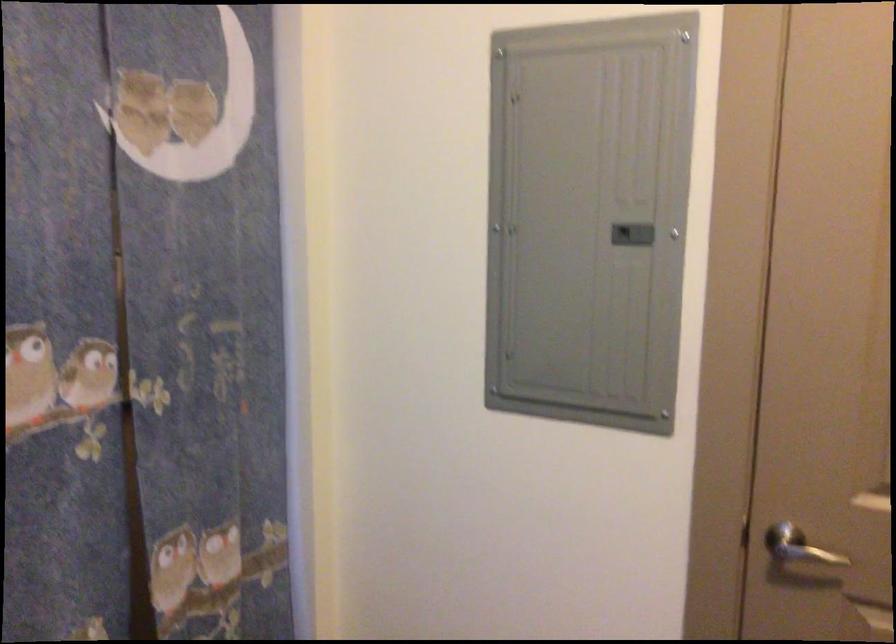
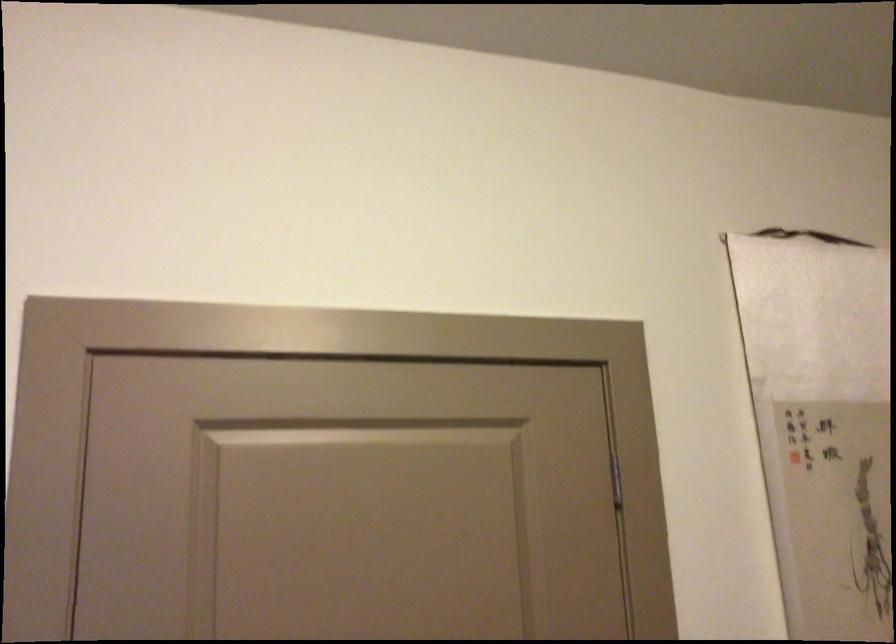
The first image is from the beginning of the video and the second image is from the end. How did the camera likely rotate when shooting the video?

The camera's rotation is toward right-up.